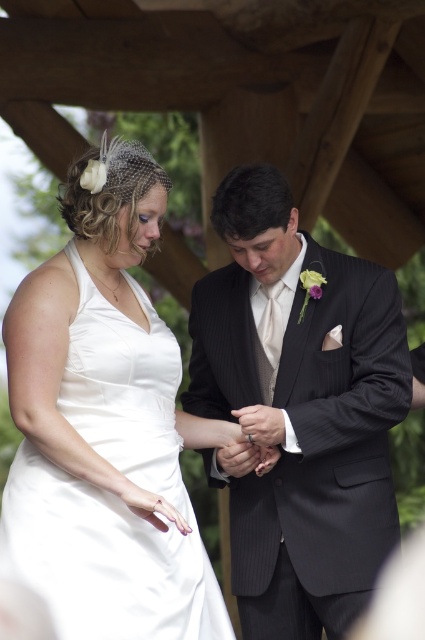
Looking at this image, you are a photographer at a wedding. You need to place a small bouquet between the two points marked as point (146, 340) and point (252, 436). Which point should the bouquet be closer to in order to appear centered from your camera angle?

The bouquet should be closer to point (146, 340) because it is closer to the viewer than point (252, 436), so positioning it there will make it appear centered from the camera angle.

You are a photographer at the wedding and want to capture a closeup shot of the silver metallic ring at center without including the black pinstripe suit at center. Based on their positions, is this possible?

The black pinstripe suit at center is positioned on the right side of the silver metallic ring at center. Since the ring is to the left of the suit, you can adjust the camera angle to frame the ring without including the suit on its right side.